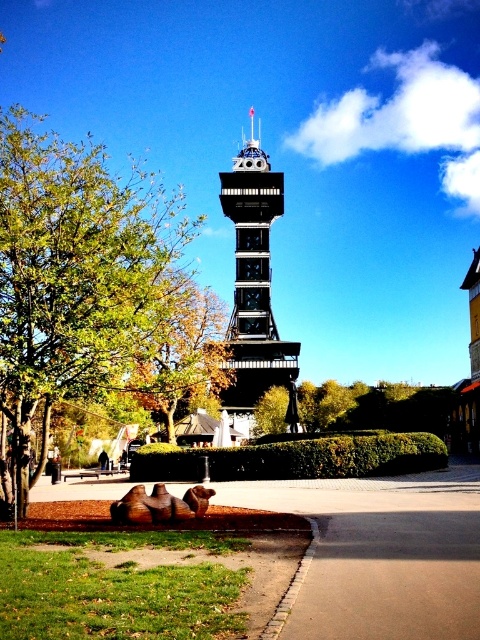
You are standing at the entrance of the garden and see the green leafy tree at left and the black metal bell tower at center. Which object is closer to the ground?

The green leafy tree at left is located below the black metal bell tower at center, so it is closer to the ground.

You are standing at the base of the tower and want to walk towards the brown wood tree at center. Which direction should you walk to avoid stepping on the green grass at lower left?

To avoid stepping on the green grass at lower left, walk towards the brown wood tree at center while staying on the paved pathway that curves around the green grass at lower left. Since the green grass at lower left is closer to you, moving towards the tree which is further away allows you to navigate around the grassy area safely.